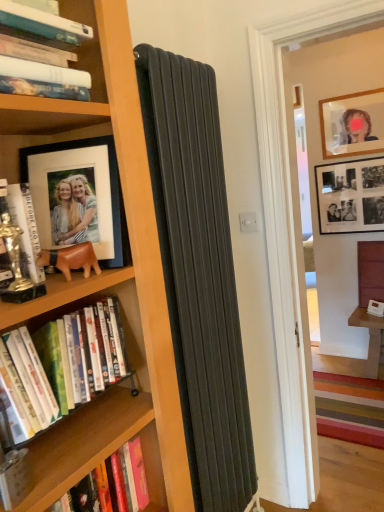
Question: Considering the positions of matte glass picture frame at upper right, arranged as the 2th picture frame when viewed from the front, and leather-like brown bear at left in the image, is matte glass picture frame at upper right, arranged as the 2th picture frame when viewed from the front, wider or thinner than leather-like brown bear at left?

Choices:
 (A) thin
 (B) wide

Answer: (A)

Question: Is matte glass picture frame at upper right, which is the 1th picture frame in top-to-bottom order, spatially inside leather-like brown bear at left, or outside of it?

Choices:
 (A) outside
 (B) inside

Answer: (A)

Question: Considering the real-world distances, which object is farthest from the hardcover book at upper left, the 4th book positioned from the bottom?

Choices:
 (A) black matte picture frame at left, placed as the first picture frame when sorted from left to right
 (B) hardcover books at left, placed as the 3th book when sorted from top to bottom
 (C) hardcover book at lower left, the 4th book in the top-to-bottom sequence
 (D) black matte photo frame at upper right, which is the 3th picture frame in left-to-right order
 (E) leather-like brown bear at left

Answer: (D)

Question: Which object is positioned closest to the leather-like brown bear at left?

Choices:
 (A) hardcover books at left, the second book from the bottom
 (B) matte glass picture frame at upper right, the 2th picture frame positioned from the right
 (C) hardcover book at lower left, the 4th book in the top-to-bottom sequence
 (D) black matte picture frame at left, arranged as the 1th picture frame when viewed from the front
 (E) hardcover book at left, the third book in the bottom-to-top sequence

Answer: (E)